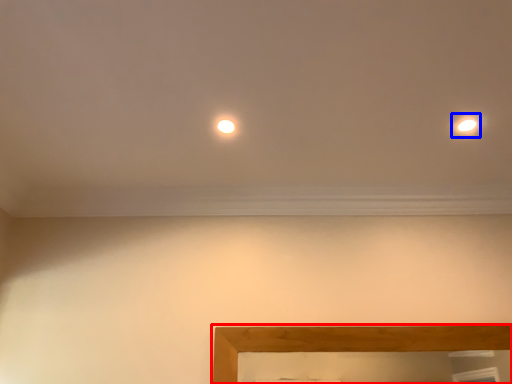
Question: Among these objects, which one is nearest to the camera, picture frame (highlighted by a red box) or light (highlighted by a blue box)?

Choices:
 (A) picture frame
 (B) light

Answer: (B)